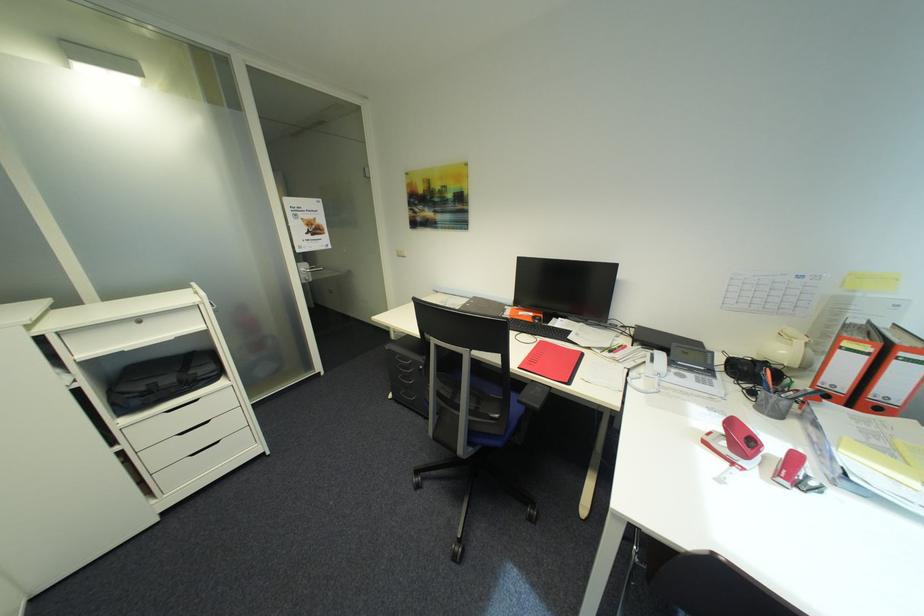
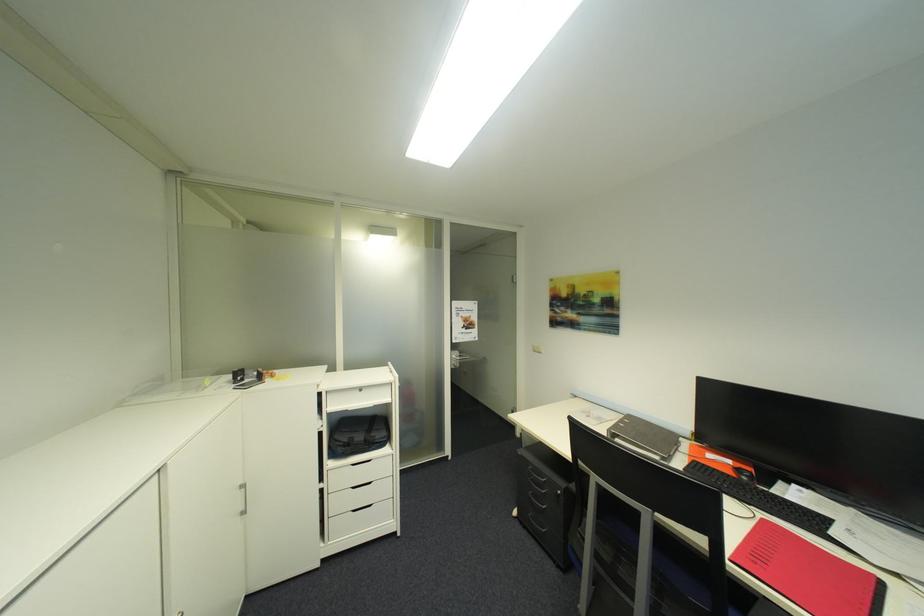
In the second image, find the point that corresponds to point 476,302 in the first image.

(628, 422)